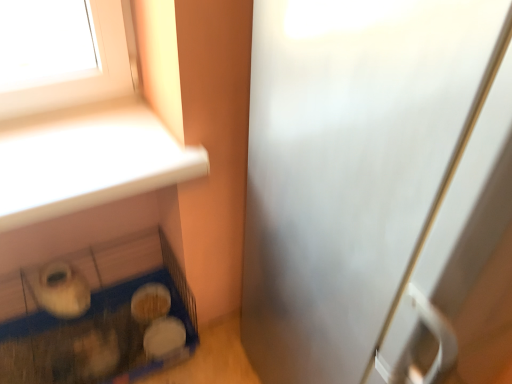
Question: Is white matte bowl at lower center, arranged as the 1th food when ordered from the bottom, bigger or smaller than satin silver screen door at right?

Choices:
 (A) small
 (B) big

Answer: (A)

Question: Do you think white matte bowl at lower center, which is the second food from top to bottom, is within satin silver screen door at right, or outside of it?

Choices:
 (A) inside
 (B) outside

Answer: (B)

Question: Which object is the closest to the blue plastic bird cage at lower left?

Choices:
 (A) white matte food at lower left, which is the second food from bottom to top
 (B) satin silver screen door at right
 (C) white matte bowl at lower center, arranged as the 1th food when ordered from the bottom

Answer: (A)

Question: Based on their relative distances, which object is nearer to the blue plastic bird cage at lower left?

Choices:
 (A) white matte food at lower left, which is the second food from bottom to top
 (B) white matte bowl at lower center, which is the second food from top to bottom
 (C) satin silver screen door at right

Answer: (A)